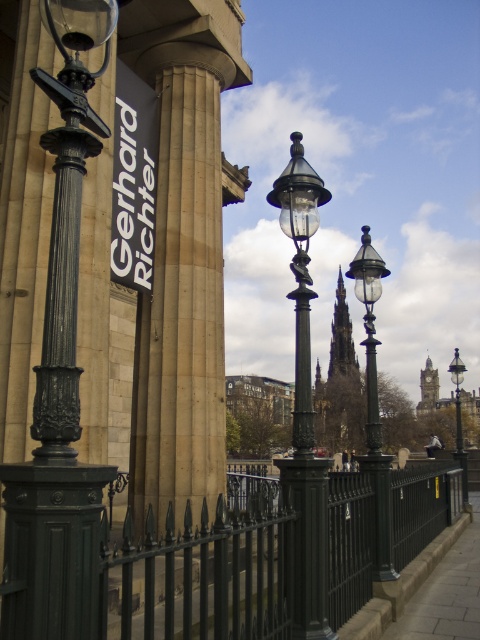
Question: Where is polished black lamp post at center located in relation to matte black street light at right in the image?

Choices:
 (A) right
 (B) left

Answer: (B)

Question: Which is farther from the matte black street light at right?

Choices:
 (A) polished brass street light at center
 (B) black wrought iron fence at lower center

Answer: (A)

Question: Can you confirm if polished brass street light at center is positioned to the left of black matte sign at upper left?

Choices:
 (A) no
 (B) yes

Answer: (A)

Question: Which point is farther from the camera taking this photo?

Choices:
 (A) (143, 280)
 (B) (252, 547)
 (C) (462, 483)
 (D) (149, 464)

Answer: (C)

Question: Does black wrought iron fence at lower center appear over matte black street light at right?

Choices:
 (A) yes
 (B) no

Answer: (A)

Question: Which point is farther to the camera?

Choices:
 (A) polished brass street light at center
 (B) beige stone column at center
 (C) polished black lamp post at center

Answer: (B)